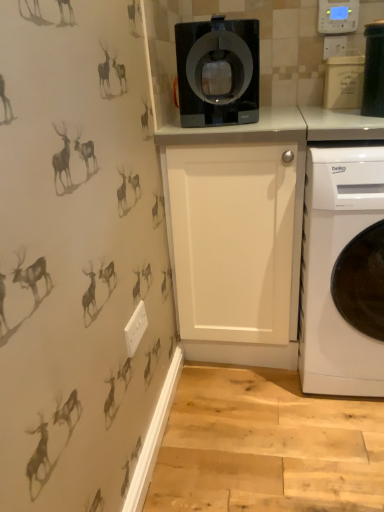
Question: From the image's perspective, is black plastic container at upper right, placed as the 2th appliance when sorted from back to front, above or below black glossy coffee machine at upper center?

Choices:
 (A) above
 (B) below

Answer: (A)

Question: Relative to black glossy coffee machine at upper center, is black plastic container at upper right, marked as the 1th appliance in a front-to-back arrangement, in front or behind?

Choices:
 (A) front
 (B) behind

Answer: (A)

Question: Which object is the farthest from the black glossy coffee machine at upper center?

Choices:
 (A) white glossy washing machine at lower right
 (B) white glossy cabinet at center
 (C) black plastic container at upper right, marked as the 1th appliance in a front-to-back arrangement
 (D) white matte container at upper right, which is counted as the second appliance, starting from the front

Answer: (C)

Question: Which object is the closest to the black plastic container at upper right, marked as the 1th appliance in a front-to-back arrangement?

Choices:
 (A) black glossy coffee machine at upper center
 (B) white glossy cabinet at center
 (C) white matte container at upper right, which is counted as the second appliance, starting from the front
 (D) white glossy washing machine at lower right

Answer: (C)